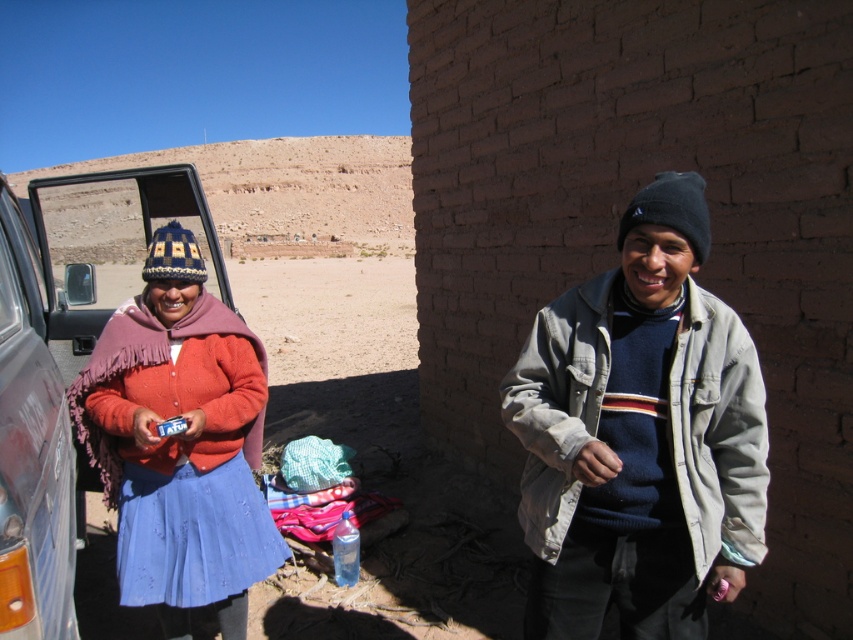
Does point (103, 460) come farther from viewer compared to point (4, 180)?

No, (103, 460) is in front of (4, 180).

Who is lower down, knitted woolen hat at left or metallic gray suv at left?

knitted woolen hat at left is lower down.

The height and width of the screenshot is (640, 853). What do you see at coordinates (180, 442) in the screenshot?
I see `knitted woolen hat at left` at bounding box center [180, 442].

Identify the location of knitted woolen hat at left. The image size is (853, 640). (180, 442).

Measure the distance between light gray cotton jacket at right and camera.

light gray cotton jacket at right is 2.23 meters from camera.

Is point (573, 541) closer to camera compared to point (229, 547)?

That is True.

Describe the element at coordinates (639, 435) in the screenshot. This screenshot has width=853, height=640. I see `light gray cotton jacket at right` at that location.

Identify the location of light gray cotton jacket at right. Image resolution: width=853 pixels, height=640 pixels. (639, 435).

Does light gray cotton jacket at right appear on the left side of metallic gray suv at left?

No, light gray cotton jacket at right is not to the left of metallic gray suv at left.

What do you see at coordinates (639, 435) in the screenshot? This screenshot has width=853, height=640. I see `light gray cotton jacket at right` at bounding box center [639, 435].

Between point (693, 352) and point (67, 596), which one is positioned in front?

Positioned in front is point (67, 596).

I want to click on light gray cotton jacket at right, so click(639, 435).